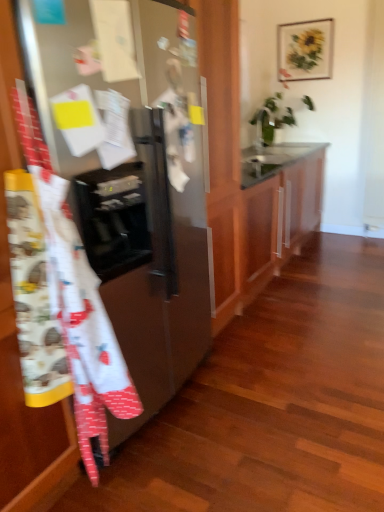
Question: Is glossy wood cabinet at center smaller than satin silver refrigerator at left?

Choices:
 (A) yes
 (B) no

Answer: (B)

Question: Is glossy wood cabinet at center placed right next to satin silver refrigerator at left?

Choices:
 (A) no
 (B) yes

Answer: (A)

Question: From the image's perspective, is glossy wood cabinet at center on satin silver refrigerator at left?

Choices:
 (A) no
 (B) yes

Answer: (B)

Question: Is glossy wood cabinet at center shorter than satin silver refrigerator at left?

Choices:
 (A) no
 (B) yes

Answer: (B)

Question: Is glossy wood cabinet at center positioned beyond the bounds of satin silver refrigerator at left?

Choices:
 (A) no
 (B) yes

Answer: (B)

Question: Is glossy wood cabinet at center to the right of satin silver refrigerator at left from the viewer's perspective?

Choices:
 (A) no
 (B) yes

Answer: (B)

Question: Is white cotton apron at left positioned far away from satin silver refrigerator at left?

Choices:
 (A) yes
 (B) no

Answer: (B)

Question: Can you confirm if white cotton apron at left is positioned to the right of satin silver refrigerator at left?

Choices:
 (A) yes
 (B) no

Answer: (A)

Question: Is white cotton apron at left behind satin silver refrigerator at left?

Choices:
 (A) yes
 (B) no

Answer: (B)

Question: Does white cotton apron at left have a greater width compared to satin silver refrigerator at left?

Choices:
 (A) yes
 (B) no

Answer: (B)

Question: Is white cotton apron at left aimed at satin silver refrigerator at left?

Choices:
 (A) no
 (B) yes

Answer: (A)

Question: From a real-world perspective, is white cotton apron at left over satin silver refrigerator at left?

Choices:
 (A) yes
 (B) no

Answer: (B)

Question: Does white glossy sink at upper center have a greater width compared to white cotton apron at left?

Choices:
 (A) yes
 (B) no

Answer: (A)